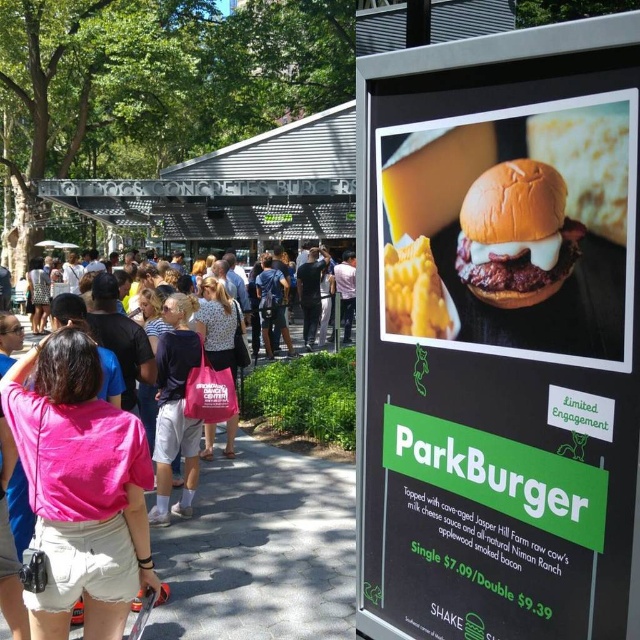
Between shiny black sign at upper right and pink fabric shirt at center, which one is positioned higher?

shiny black sign at upper right

The height and width of the screenshot is (640, 640). What do you see at coordinates (502, 337) in the screenshot?
I see `shiny black sign at upper right` at bounding box center [502, 337].

The width and height of the screenshot is (640, 640). Find the location of `shiny black sign at upper right`. shiny black sign at upper right is located at coordinates (502, 337).

Measure the distance between point [486,166] and camera.

Point [486,166] and camera are 1.77 meters apart from each other.

What are the coordinates of `shiny golden cheeseburger at center` in the screenshot? It's located at (513, 230).

Does pink fabric crowd at center come in front of golden brown bun at center?

No, pink fabric crowd at center is behind golden brown bun at center.

Between pink fabric crowd at center and golden brown bun at center, which one has less height?

golden brown bun at center is shorter.

Which is in front, point (182, 634) or point (476, 180)?

Point (476, 180) is in front.

Where is `pink fabric crowd at center`? pink fabric crowd at center is located at coordinates (260, 550).